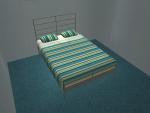
The image size is (150, 113). I want to click on floor at foot of bed, so click(95, 86).